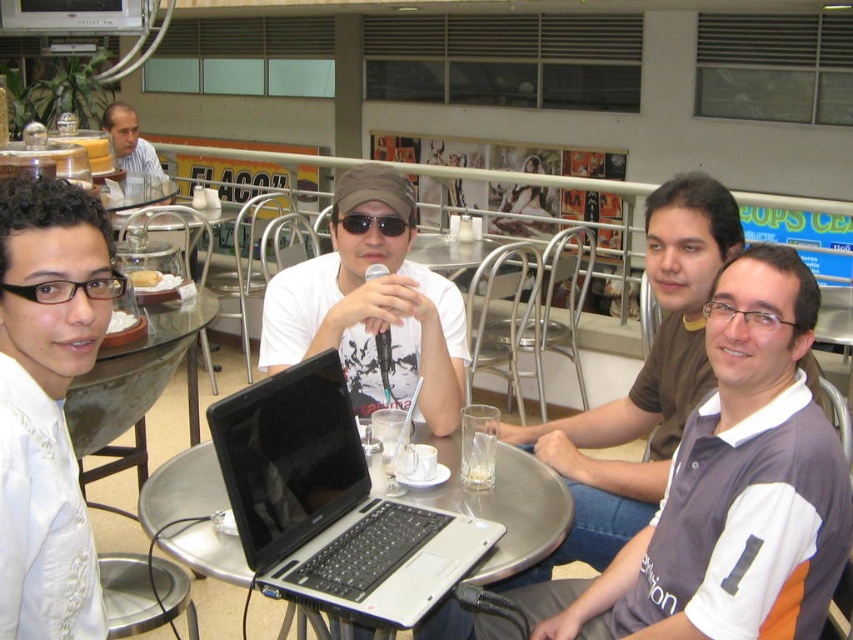
You are a barista at this cafe and need to place a new menu stand between the clear glass at table center and the black matte sunglasses at center so it can be seen by both people. Is there enough space between them to fit the menu stand that is 18 inches wide?

The clear glass at table center and black matte sunglasses at center are 21.77 inches apart, so yes, the menu stand that is 18 inches wide can fit between them since the space is wider than the stand.

In the scene described, there is a clear glass at table center and black matte sunglasses at center. From the perspective of someone sitting at the table, which object is positioned to the right of the other?

The clear glass at table center is to the right of the black matte sunglasses at center.